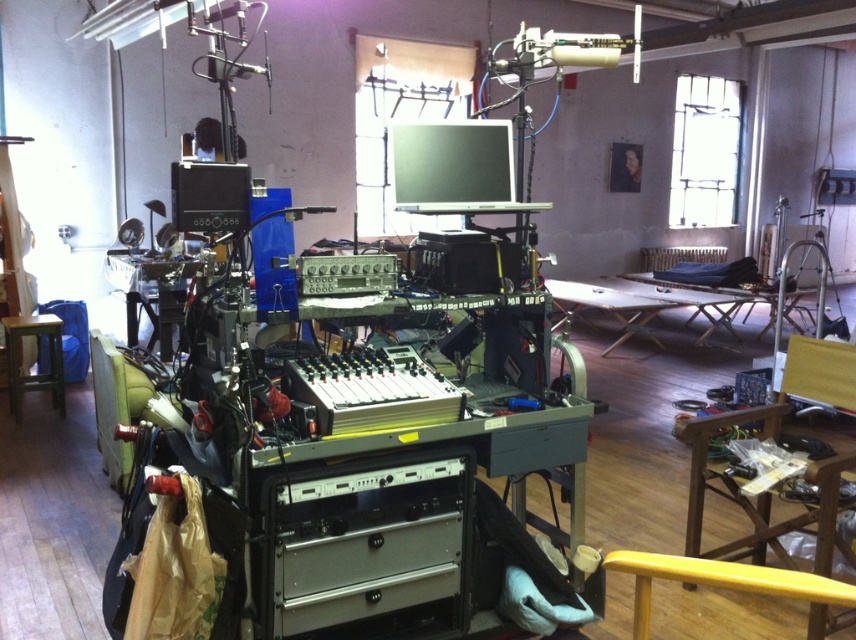
Question: Is wooden folding table at center bigger than wooden stool at lower left?

Choices:
 (A) yes
 (B) no

Answer: (A)

Question: Which point is farther to the camera?

Choices:
 (A) wooden folding table at center
 (B) wooden stool at lower left

Answer: (A)

Question: Can you confirm if wooden folding table at center is positioned above wooden stool at lower left?

Choices:
 (A) no
 (B) yes

Answer: (B)

Question: Which point is closer to the camera?

Choices:
 (A) (599, 291)
 (B) (54, 333)

Answer: (B)

Question: Is wooden folding table at center above wooden stool at lower left?

Choices:
 (A) no
 (B) yes

Answer: (B)